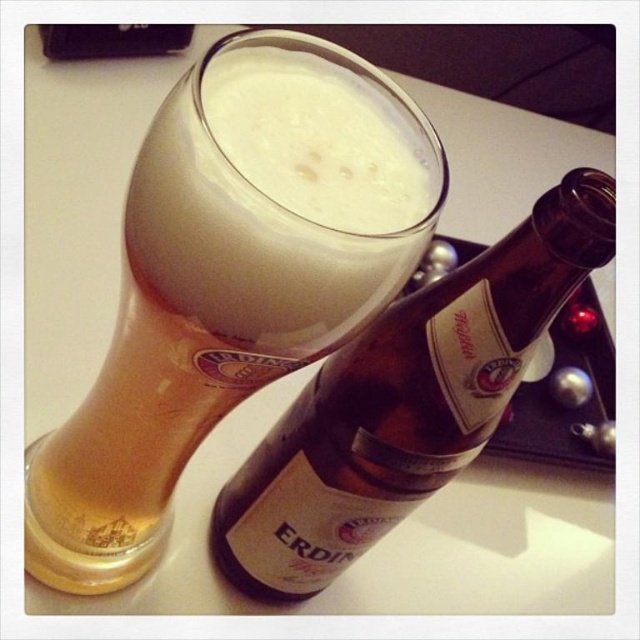
You are at a bar and want to grab the brown glass bottle at upper center to pour more beer into the foamy white beer at upper center. However, there is a small coaster between them. Can you reach the bottle without moving the coaster?

The brown glass bottle at upper center is to the right of the foamy white beer at upper center, so you can reach the bottle by moving your hand around the coaster from the right side without disturbing it.

What are the coordinates of the golden glass beer at center?

The coordinates of the golden glass beer at center are at point (202, 324).

From the picture: You are setting up a table for a party and need to arrange the golden glass beer at center and the brown glass bottle at upper center. If you want to place a decorative plate between them, which object should the plate be closer to to ensure it doesn

The golden glass beer at center is wider than the brown glass bottle at upper center, so the decorative plate should be closer to the brown glass bottle at upper center to balance the space between them.